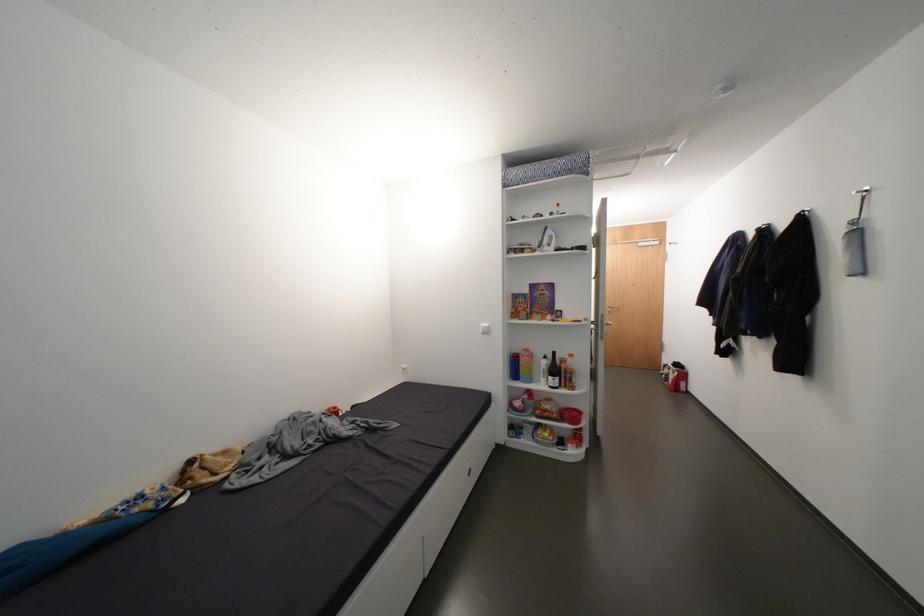
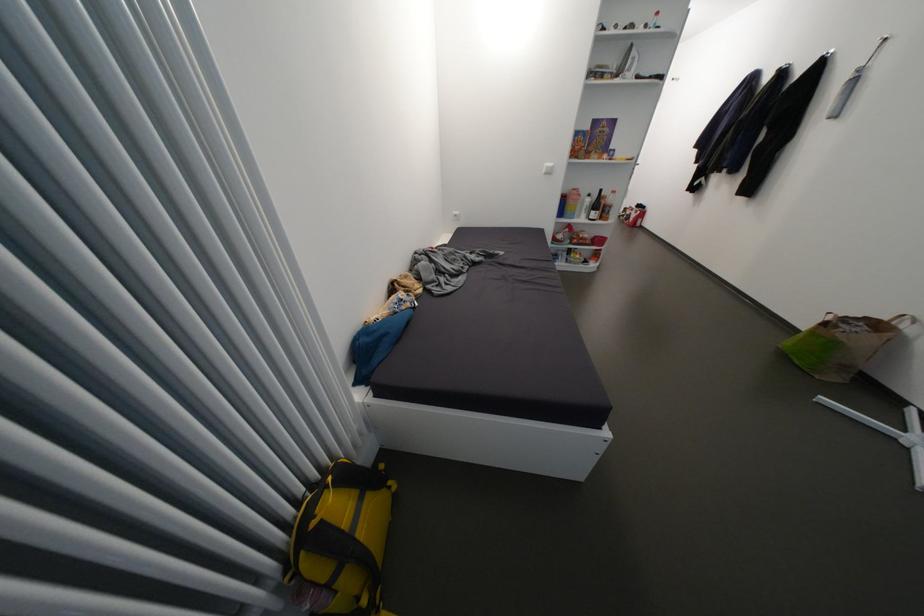
Find the pixel in the second image that matches the point at 553,363 in the first image.

(596, 201)